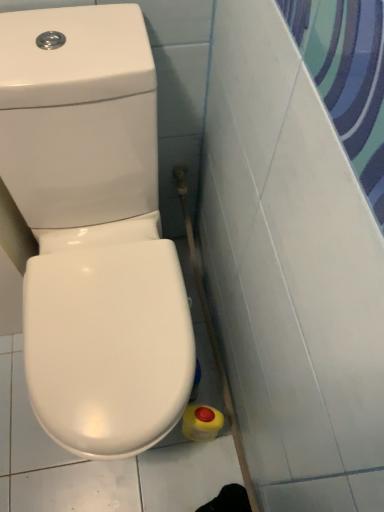
What do you see at coordinates (93, 230) in the screenshot? The height and width of the screenshot is (512, 384). I see `white glossy toilet at lower left` at bounding box center [93, 230].

The image size is (384, 512). What are the coordinates of `white glossy toilet at lower left` in the screenshot? It's located at (93, 230).

Find the location of a particular element. yellow matte bottle at lower right is located at coordinates (201, 423).

What do you see at coordinates (201, 423) in the screenshot?
I see `yellow matte bottle at lower right` at bounding box center [201, 423].

Where is `white glossy toilet at lower left`? The image size is (384, 512). white glossy toilet at lower left is located at coordinates [x=93, y=230].

Does white glossy toilet at lower left appear on the right side of yellow matte bottle at lower right?

In fact, white glossy toilet at lower left is to the left of yellow matte bottle at lower right.

Between white glossy toilet at lower left and yellow matte bottle at lower right, which one is positioned behind?

yellow matte bottle at lower right is behind.

Consider the image. Which point is more distant from viewer, (169,305) or (207,417)?

Positioned behind is point (207,417).

From the image's perspective, which one is positioned lower, white glossy toilet at lower left or yellow matte bottle at lower right?

From the image's view, yellow matte bottle at lower right is below.

From a real-world perspective, between white glossy toilet at lower left and yellow matte bottle at lower right, who is vertically lower?

In real-world perspective, yellow matte bottle at lower right is lower.

Is white glossy toilet at lower left wider or thinner than yellow matte bottle at lower right?

In the image, white glossy toilet at lower left appears to be wider than yellow matte bottle at lower right.

Is white glossy toilet at lower left taller than yellow matte bottle at lower right?

Yes, white glossy toilet at lower left is taller than yellow matte bottle at lower right.

Considering the relative sizes of white glossy toilet at lower left and yellow matte bottle at lower right in the image provided, is white glossy toilet at lower left bigger than yellow matte bottle at lower right?

Yes.

Choose the correct answer: Is white glossy toilet at lower left inside yellow matte bottle at lower right or outside it?

white glossy toilet at lower left cannot be found inside yellow matte bottle at lower right.

Is the surface of white glossy toilet at lower left in direct contact with yellow matte bottle at lower right?

No, white glossy toilet at lower left is not touching yellow matte bottle at lower right.

Is white glossy toilet at lower left aimed at yellow matte bottle at lower right?

No, white glossy toilet at lower left is not aimed at yellow matte bottle at lower right.

How different are the orientations of white glossy toilet at lower left and yellow matte bottle at lower right in degrees?

Result: white glossy toilet at lower left and yellow matte bottle at lower right are facing 0.000689 degrees away from each other.

Locate an element on the screen. toilet that is on the left side of yellow matte bottle at lower right is located at coordinates (93, 230).

Which object is positioned more to the left, yellow matte bottle at lower right or white glossy toilet at lower left?

white glossy toilet at lower left is more to the left.

Considering their positions, is yellow matte bottle at lower right located in front of or behind white glossy toilet at lower left?

yellow matte bottle at lower right is behind white glossy toilet at lower left.

Is point (198, 434) closer or farther from the camera than point (80, 32)?

Point (198, 434) is farther from the camera than point (80, 32).

From the image's perspective, between yellow matte bottle at lower right and white glossy toilet at lower left, which one is located above?

From the image's view, white glossy toilet at lower left is above.

From a real-world perspective, which object rests below the other?

yellow matte bottle at lower right, from a real-world perspective.

Considering the relative sizes of yellow matte bottle at lower right and white glossy toilet at lower left in the image provided, is yellow matte bottle at lower right thinner than white glossy toilet at lower left?

Yes, yellow matte bottle at lower right is thinner than white glossy toilet at lower left.

From their relative heights in the image, would you say yellow matte bottle at lower right is taller or shorter than white glossy toilet at lower left?

In the image, yellow matte bottle at lower right appears to be shorter than white glossy toilet at lower left.

Considering the sizes of objects yellow matte bottle at lower right and white glossy toilet at lower left in the image provided, who is smaller, yellow matte bottle at lower right or white glossy toilet at lower left?

yellow matte bottle at lower right.

Do you think yellow matte bottle at lower right is within white glossy toilet at lower left, or outside of it?

yellow matte bottle at lower right can be found inside white glossy toilet at lower left.

Would you consider yellow matte bottle at lower right to be distant from white glossy toilet at lower left?

yellow matte bottle at lower right is near white glossy toilet at lower left, not far away.

Is yellow matte bottle at lower right looking in the opposite direction of white glossy toilet at lower left?

No, yellow matte bottle at lower right is not facing away from white glossy toilet at lower left.

What's the angular difference between yellow matte bottle at lower right and white glossy toilet at lower left's facing directions?

0.000689 degrees.

Measure the distance between yellow matte bottle at lower right and white glossy toilet at lower left.

yellow matte bottle at lower right is 18.66 inches away from white glossy toilet at lower left.

This screenshot has width=384, height=512. I want to click on toilet above the yellow matte bottle at lower right (from the image's perspective), so 93,230.

Where is `toilet in front of the yellow matte bottle at lower right`? toilet in front of the yellow matte bottle at lower right is located at coordinates (93, 230).

This screenshot has width=384, height=512. I want to click on toilet on the left of the yellow matte bottle at lower right, so click(93, 230).